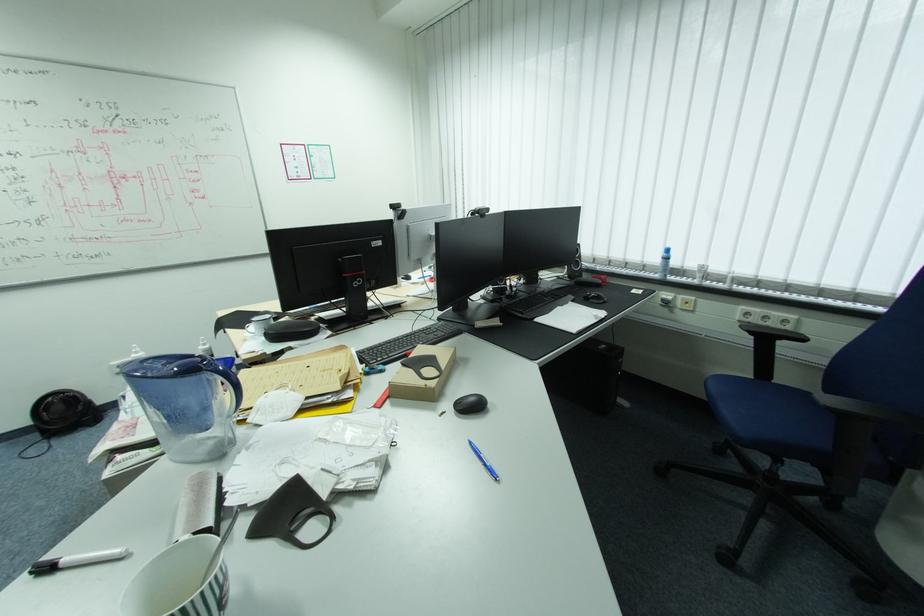
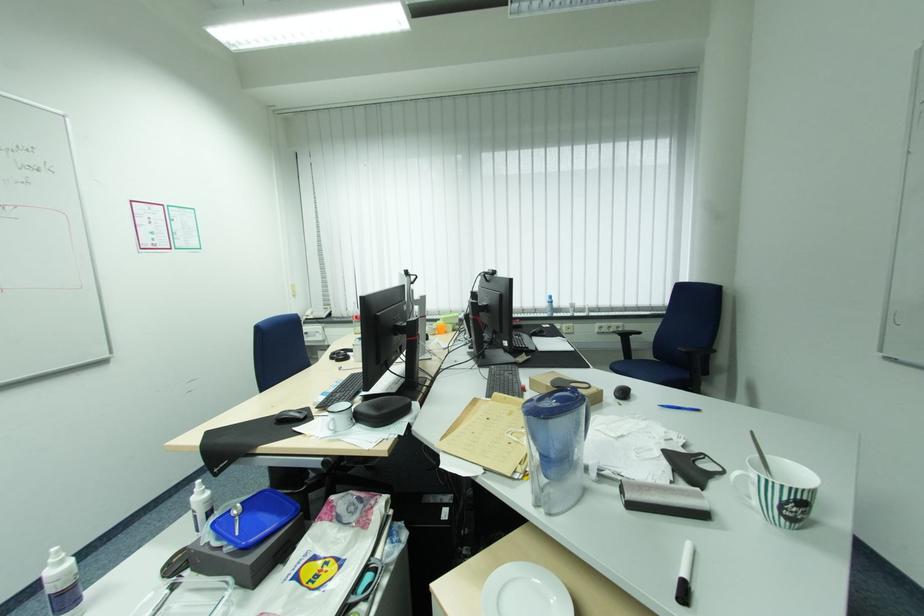
Find the pixel in the second image that matches pixel 140 346 in the first image.

(62, 548)